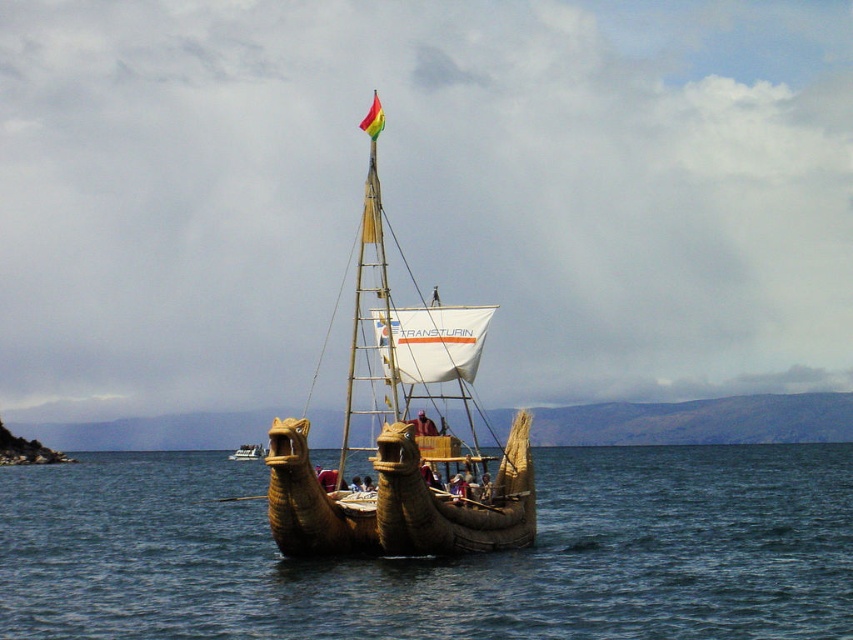
Question: Does rainbow fabric flag at top center have a smaller size compared to brown woven reed boat at center?

Choices:
 (A) yes
 (B) no

Answer: (B)

Question: Is natural wood boat at center smaller than rainbow fabric flag at top center?

Choices:
 (A) yes
 (B) no

Answer: (A)

Question: Among these points, which one is nearest to the camera?

Choices:
 (A) (242, 454)
 (B) (380, 113)
 (C) (675, 627)

Answer: (C)

Question: Considering the real-world distances, which object is closest to the brown woven reed boat at center?

Choices:
 (A) rainbow fabric flag at top center
 (B) natural wood boat at center
 (C) brown woven water at center

Answer: (A)

Question: Can you confirm if brown woven water at center is positioned to the left of rainbow fabric flag at top center?

Choices:
 (A) yes
 (B) no

Answer: (B)

Question: Which point is farther to the camera?

Choices:
 (A) rainbow fabric flag at top center
 (B) brown woven reed boat at center
 (C) wooden mast at center
 (D) brown woven water at center

Answer: (B)